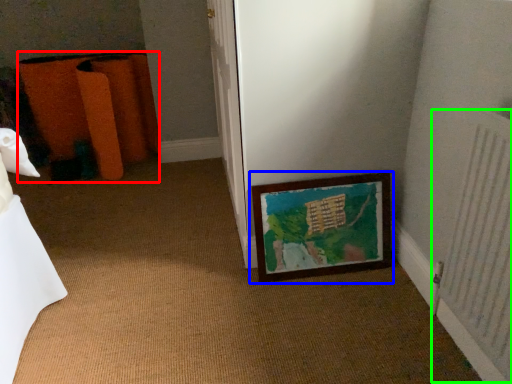
Question: Which is farther away from furniture (highlighted by a red box)? picture frame (highlighted by a blue box) or radiator (highlighted by a green box)?

Choices:
 (A) picture frame
 (B) radiator

Answer: (B)